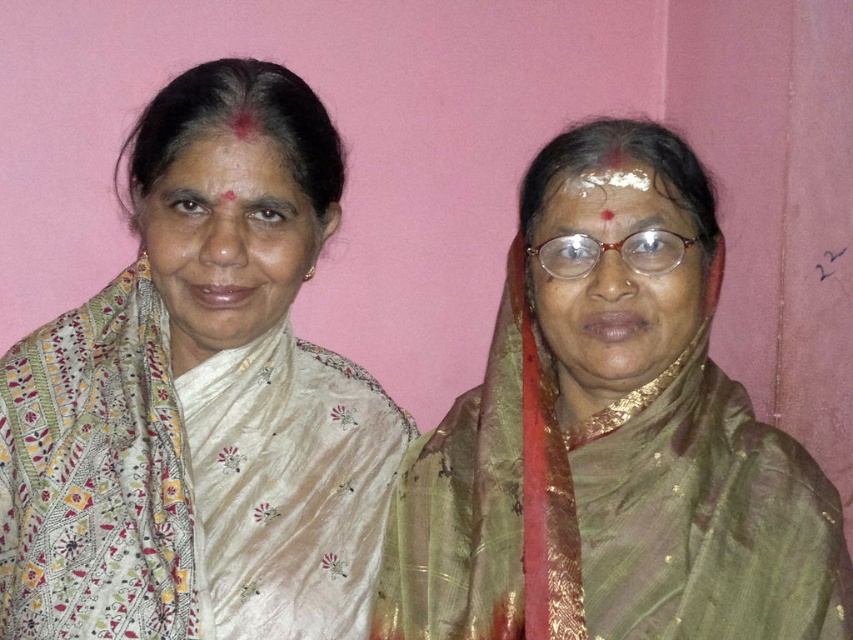
You are a photographer setting up for a photoshoot. You have a 30 cm long ruler placed horizontally between the white silk saree at left and the white powder at center. Can you fit the ruler between them without bending it?

The distance between the white silk saree at left and the white powder at center is 37.01 centimeters. Since the ruler is only 30 cm long, it can fit between them without bending.

You are a photographer setting up for a photoshoot. You need to position a matte white saree at left and a matte gold glasses at center in the frame. Given their sizes, which object will occupy more horizontal space in the image?

The matte white saree at left is wider than the matte gold glasses at center, so it will occupy more horizontal space in the image.

You are a photographer setting up a shoot for two women wearing sarees. The women are positioned 4.11 feet apart. The woman on the left is wearing a matte white saree at left, and the woman on the right is wearing a different saree. You want to ensure that the distance between them is exactly 4 feet for the shot. Should you move them closer or farther apart?

The current distance between the matte white saree at left and the other woman is 4.11 feet. To achieve the desired 4 feet, you should move them closer together by 0.11 feet.